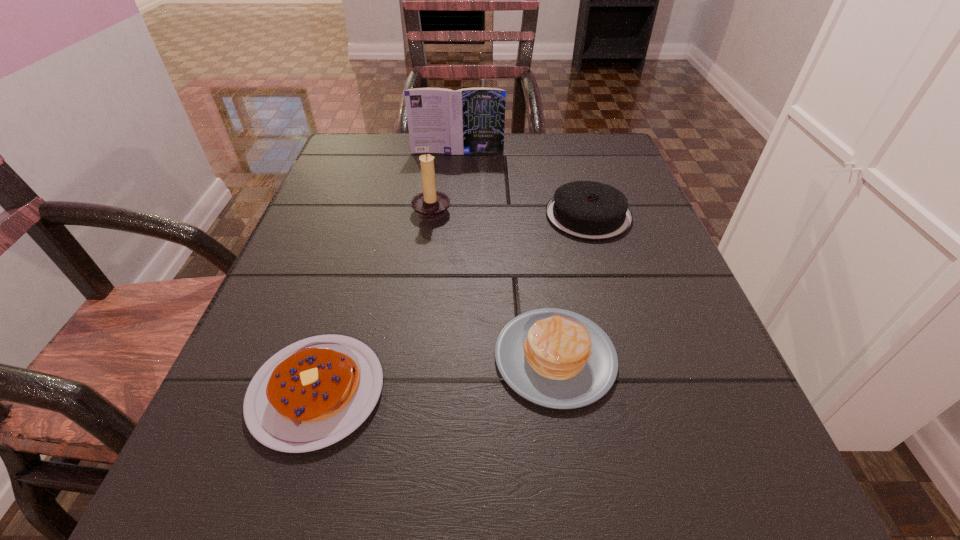
Identify the location of object located in the left edge section of the desktop. Image resolution: width=960 pixels, height=540 pixels. (313, 393).

Where is `free region at the far edge`? free region at the far edge is located at coordinates (541, 159).

Locate an element on the screen. The width and height of the screenshot is (960, 540). blank space at the left edge is located at coordinates (274, 294).

Identify the location of free location at the right edge. Image resolution: width=960 pixels, height=540 pixels. point(648,354).

Identify the location of vacant space at the far left corner. The image size is (960, 540). (346, 163).

This screenshot has height=540, width=960. In the image, there is a desktop. Find the location of `vacant space at the far right corner`. vacant space at the far right corner is located at coordinates (619, 179).

The width and height of the screenshot is (960, 540). Find the location of `blank space at the near right corner of the desktop`. blank space at the near right corner of the desktop is located at coordinates (719, 465).

Identify the location of free space between the farthest pancake and the second tallest object. (510, 212).

Locate an element on the screen. vacant space that's between the farthest pancake and the leftmost pancake is located at coordinates click(x=452, y=303).

Find the location of `empty space between the candle holder and the farthest pancake`. empty space between the candle holder and the farthest pancake is located at coordinates (510, 212).